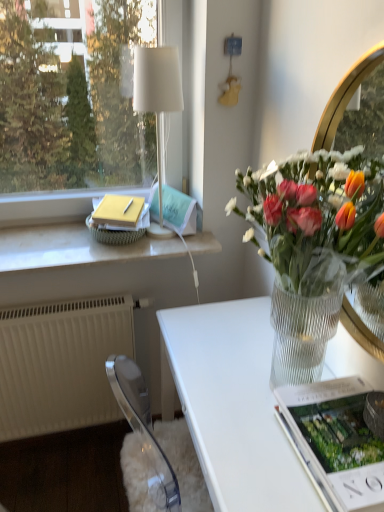
I want to click on free space above white plastic radiator at lower left (from a real-world perspective), so click(71, 294).